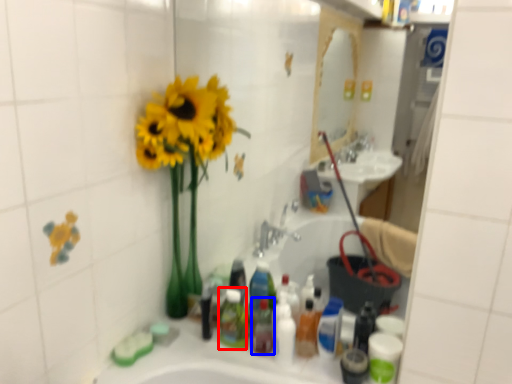
Question: Which of the following is the closest to the observer, toiletry (highlighted by a red box) or mouthwash (highlighted by a blue box)?

Choices:
 (A) toiletry
 (B) mouthwash

Answer: (B)